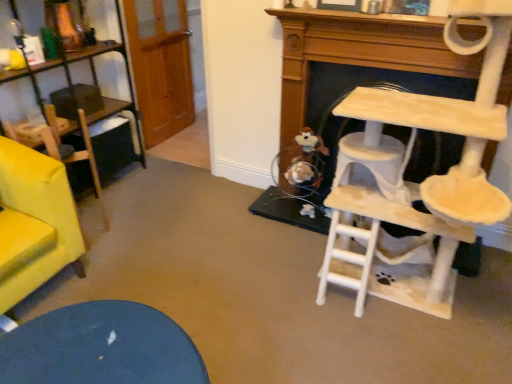
Question: Are beige wooden cat tree at right and brown plush toy at lower center making contact?

Choices:
 (A) no
 (B) yes

Answer: (A)

Question: Considering the relative sizes of beige wooden cat tree at right and brown plush toy at lower center in the image provided, is beige wooden cat tree at right taller than brown plush toy at lower center?

Choices:
 (A) yes
 (B) no

Answer: (A)

Question: Is beige wooden cat tree at right positioned with its back to brown plush toy at lower center?

Choices:
 (A) yes
 (B) no

Answer: (B)

Question: Is beige wooden cat tree at right completely or partially outside of brown plush toy at lower center?

Choices:
 (A) no
 (B) yes

Answer: (B)

Question: Does beige wooden cat tree at right appear on the right side of brown plush toy at lower center?

Choices:
 (A) yes
 (B) no

Answer: (A)

Question: Does point (48, 127) appear closer or farther from the camera than point (293, 180)?

Choices:
 (A) farther
 (B) closer

Answer: (B)

Question: Would you say velvet yellow armchair at left is to the left or to the right of brown plush toy at lower center in the picture?

Choices:
 (A) right
 (B) left

Answer: (B)

Question: From their relative heights in the image, would you say velvet yellow armchair at left is taller or shorter than brown plush toy at lower center?

Choices:
 (A) short
 (B) tall

Answer: (B)

Question: In the image, is velvet yellow armchair at left positioned in front of or behind brown plush toy at lower center?

Choices:
 (A) behind
 (B) front

Answer: (B)

Question: Is brown plush toy at lower center spatially inside beige wooden cat tree at right, or outside of it?

Choices:
 (A) inside
 (B) outside

Answer: (B)

Question: In terms of height, does brown plush toy at lower center look taller or shorter compared to beige wooden cat tree at right?

Choices:
 (A) tall
 (B) short

Answer: (B)

Question: From the image's perspective, is brown plush toy at lower center located above or below beige wooden cat tree at right?

Choices:
 (A) above
 (B) below

Answer: (A)

Question: Is brown plush toy at lower center wider or thinner than beige wooden cat tree at right?

Choices:
 (A) wide
 (B) thin

Answer: (B)

Question: In terms of height, does beige wooden cat tree at right look taller or shorter compared to beige felt cat tree at right?

Choices:
 (A) short
 (B) tall

Answer: (B)

Question: Is beige wooden cat tree at right wider or thinner than beige felt cat tree at right?

Choices:
 (A) thin
 (B) wide

Answer: (B)